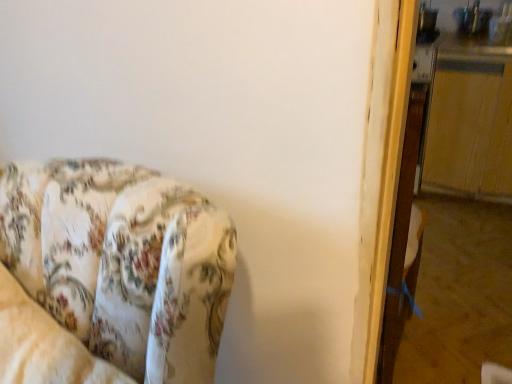
I want to click on floral fabric couch at left, so click(x=110, y=275).

The height and width of the screenshot is (384, 512). What do you see at coordinates (110, 275) in the screenshot?
I see `floral fabric couch at left` at bounding box center [110, 275].

I want to click on floral fabric couch at left, so click(110, 275).